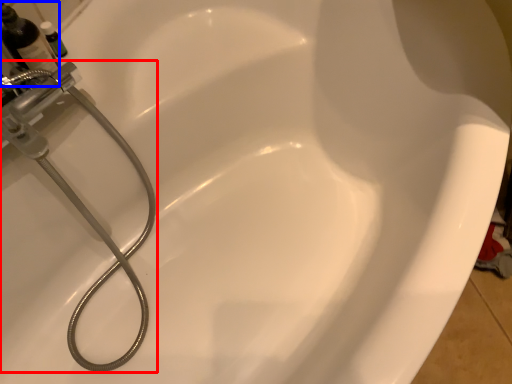
Question: Which point is further to the camera, plumbing fixture (highlighted by a red box) or bottle (highlighted by a blue box)?

Choices:
 (A) plumbing fixture
 (B) bottle

Answer: (B)